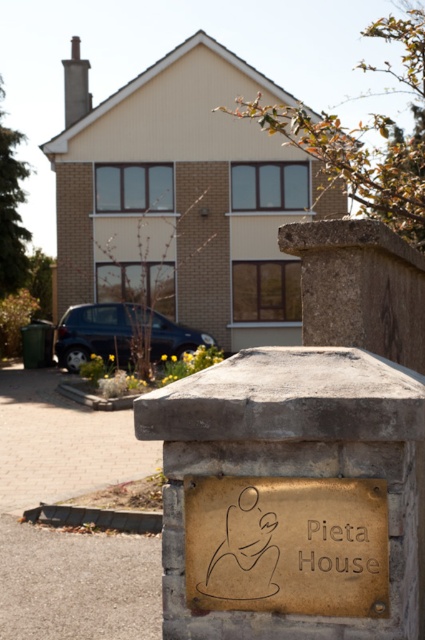
The height and width of the screenshot is (640, 425). What do you see at coordinates (286, 545) in the screenshot?
I see `gold textured plaque at center` at bounding box center [286, 545].

Is point (288, 548) less distant than point (365, 566)?

No, (288, 548) is further to viewer.

You are a GUI agent. You are given a task and a screenshot of the screen. Output one action in this format:
    pyautogui.click(x=<x>, y=<y>)
    Task: Click on the gold textured plaque at center
    Image resolution: width=425 pixels, height=640 pixels.
    Given the screenshot: What is the action you would take?
    pyautogui.click(x=286, y=545)